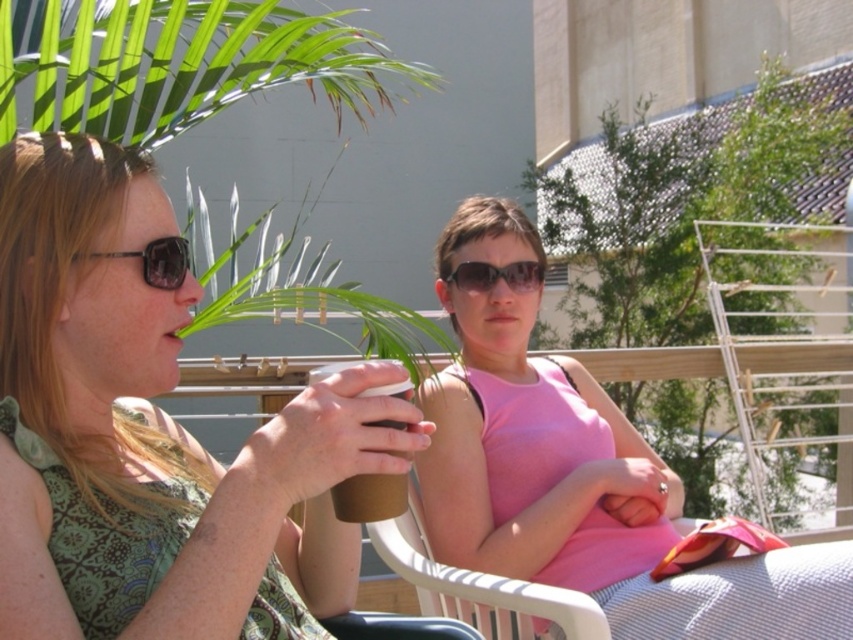
Is pink fabric dress at center positioned before brown paper cup at center?

No, it is not.

Does pink fabric dress at center appear on the right side of brown paper cup at center?

Indeed, pink fabric dress at center is positioned on the right side of brown paper cup at center.

Who is more distant from viewer, (508, 410) or (376, 422)?

The point (508, 410) is more distant.

At what (x,y) coordinates should I click in order to perform the action: click on pink fabric dress at center. Please return your answer as a coordinate pair (x, y). Looking at the image, I should click on (581, 476).

Is point (186, 253) farther from camera compared to point (531, 260)?

No, it is not.

Between matte black sunglasses at left and sunglasses at center, which one appears on the left side from the viewer's perspective?

matte black sunglasses at left

At what (x,y) coordinates should I click in order to perform the action: click on matte black sunglasses at left. Please return your answer as a coordinate pair (x, y). Looking at the image, I should click on (155, 260).

Image resolution: width=853 pixels, height=640 pixels. I want to click on matte black sunglasses at left, so click(x=155, y=260).

What do you see at coordinates (369, 497) in the screenshot? I see `brown paper cup at center` at bounding box center [369, 497].

Is point (321, 372) positioned after point (126, 253)?

No, it is not.

Describe the element at coordinates (369, 497) in the screenshot. Image resolution: width=853 pixels, height=640 pixels. I see `brown paper cup at center` at that location.

Find the location of `brown paper cup at center`. brown paper cup at center is located at coordinates (369, 497).